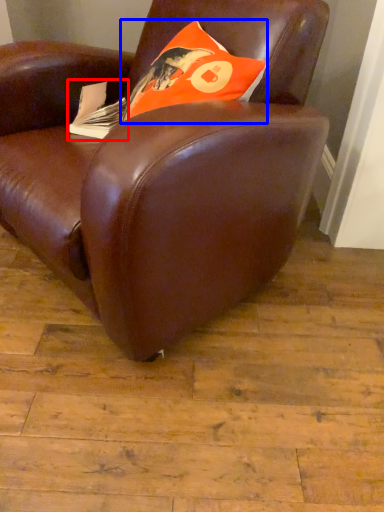
Question: Which object is further to the camera taking this photo, paperback book (highlighted by a red box) or throw pillow (highlighted by a blue box)?

Choices:
 (A) paperback book
 (B) throw pillow

Answer: (A)